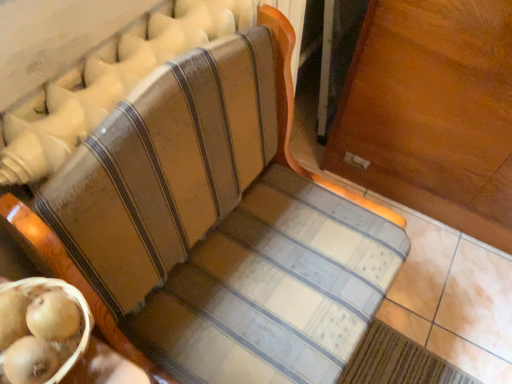
What do you see at coordinates (109, 369) in the screenshot? The image size is (512, 384). I see `wooden textured basket at lower left` at bounding box center [109, 369].

Find the location of a particular element. Image resolution: width=512 pixels, height=384 pixels. wooden textured basket at lower left is located at coordinates (109, 369).

What is the approximate width of wooden textured basket at lower left?

6.38 inches.

What do you see at coordinates (42, 330) in the screenshot? This screenshot has height=384, width=512. I see `smooth golden kiwi at lower left` at bounding box center [42, 330].

What is the approximate width of smooth golden kiwi at lower left?

smooth golden kiwi at lower left is 1.78 inches wide.

Where is `smooth golden kiwi at lower left`? smooth golden kiwi at lower left is located at coordinates (42, 330).

Find the location of a particular element. wooden textured basket at lower left is located at coordinates (109, 369).

Which object is positioned more to the right, wooden textured basket at lower left or smooth golden kiwi at lower left?

Positioned to the right is smooth golden kiwi at lower left.

Is the depth of wooden textured basket at lower left less than that of smooth golden kiwi at lower left?

Yes, it is.

Does point (101, 350) lie behind point (73, 289)?

Yes, it is.

From the image's perspective, which one is positioned higher, wooden textured basket at lower left or smooth golden kiwi at lower left?

smooth golden kiwi at lower left is shown above in the image.

From a real-world perspective, which object stands above the other?

smooth golden kiwi at lower left, from a real-world perspective.

Between wooden textured basket at lower left and smooth golden kiwi at lower left, which one has smaller width?

With smaller width is smooth golden kiwi at lower left.

From the picture: Considering the relative sizes of wooden textured basket at lower left and smooth golden kiwi at lower left in the image provided, is wooden textured basket at lower left taller than smooth golden kiwi at lower left?

Correct, wooden textured basket at lower left is much taller as smooth golden kiwi at lower left.

Does wooden textured basket at lower left have a larger size compared to smooth golden kiwi at lower left?

Yes.

Does wooden textured basket at lower left contain smooth golden kiwi at lower left?

Yes, smooth golden kiwi at lower left is surrounded by wooden textured basket at lower left.

Is wooden textured basket at lower left next to smooth golden kiwi at lower left?

Absolutely, wooden textured basket at lower left is next to and touching smooth golden kiwi at lower left.

Is wooden textured basket at lower left facing away from smooth golden kiwi at lower left?

That's not correct — wooden textured basket at lower left is not looking away from smooth golden kiwi at lower left.

Where is `table directly beneath the smooth golden kiwi at lower left (from a real-world perspective)`? The image size is (512, 384). table directly beneath the smooth golden kiwi at lower left (from a real-world perspective) is located at coordinates (109, 369).

Does smooth golden kiwi at lower left appear on the right side of wooden textured basket at lower left?

Yes.

Is smooth golden kiwi at lower left positioned before wooden textured basket at lower left?

No, smooth golden kiwi at lower left is behind wooden textured basket at lower left.

Which point is more distant from viewer, (x=42, y=340) or (x=103, y=381)?

Positioned behind is point (x=103, y=381).

From the image's perspective, would you say smooth golden kiwi at lower left is positioned over wooden textured basket at lower left?

Yes, from the image's perspective, smooth golden kiwi at lower left is over wooden textured basket at lower left.

From a real-world perspective, which object stands above the other?

smooth golden kiwi at lower left.

Does smooth golden kiwi at lower left have a greater width compared to wooden textured basket at lower left?

In fact, smooth golden kiwi at lower left might be narrower than wooden textured basket at lower left.

Between smooth golden kiwi at lower left and wooden textured basket at lower left, which one has less height?

Standing shorter between the two is smooth golden kiwi at lower left.

Who is smaller, smooth golden kiwi at lower left or wooden textured basket at lower left?

smooth golden kiwi at lower left is smaller.

Is smooth golden kiwi at lower left not within wooden textured basket at lower left?

That's incorrect, smooth golden kiwi at lower left is not completely outside wooden textured basket at lower left.

Is smooth golden kiwi at lower left far away from wooden textured basket at lower left?

No.

Could you tell me if smooth golden kiwi at lower left is turned towards wooden textured basket at lower left?

Yes.

What's the angular difference between smooth golden kiwi at lower left and wooden textured basket at lower left's facing directions?

The angle between the facing direction of smooth golden kiwi at lower left and the facing direction of wooden textured basket at lower left is 27.2 degrees.

Measure the distance from smooth golden kiwi at lower left to wooden textured basket at lower left.

smooth golden kiwi at lower left is 1.70 inches away from wooden textured basket at lower left.

This screenshot has height=384, width=512. I want to click on fruit lying on the right of wooden textured basket at lower left, so click(42, 330).

Locate an element on the screen. The height and width of the screenshot is (384, 512). table lying in front of the smooth golden kiwi at lower left is located at coordinates (109, 369).

This screenshot has width=512, height=384. I want to click on fruit behind the wooden textured basket at lower left, so click(42, 330).